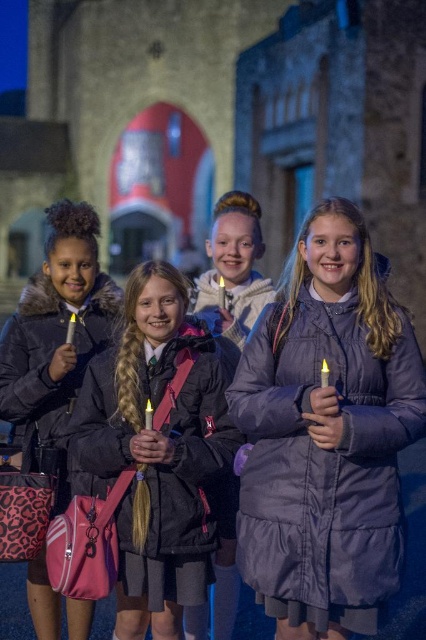
You are a photographer trying to capture the purple puffy coat at center in the image. Based on its coordinates, where should you focus your camera?

The purple puffy coat at center is located at coordinates point (325, 435), so you should focus your camera there to capture it.

You are a photographer trying to capture a clear shot of both the purple puffy coat at center and the matte purple coat at center. Since the lighting is dim, you want to ensure both are visible. Which coat should you focus on first to ensure it appears taller in the photo?

The purple puffy coat at center is taller than the matte purple coat at center, so focusing on it first will ensure its height is captured clearly in the dim lighting.

You are a photographer trying to capture the group of girls holding candles in front of the stone building. You need to focus on the black matte jacket at center. Where should you aim your camera to ensure the jacket is in the center of the photo?

You should aim your camera at the coordinates point (158, 451) where the black matte jacket at center is located to ensure it is centered in the photo.